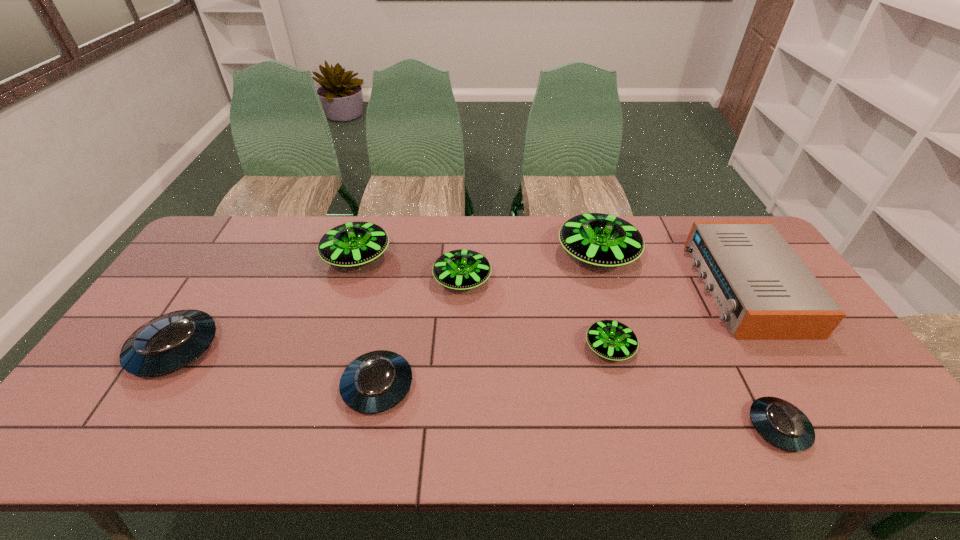
Identify the location of the tallest saucer. This screenshot has width=960, height=540. (598, 239).

The width and height of the screenshot is (960, 540). Identify the location of the tallest object. (598, 239).

This screenshot has height=540, width=960. I want to click on the leftmost green saucer, so click(352, 244).

The width and height of the screenshot is (960, 540). What are the coordinates of `the second biggest green saucer` in the screenshot? It's located at (352, 244).

Locate an element on the screen. radio receiver is located at coordinates (764, 291).

You are a GUI agent. You are given a task and a screenshot of the screen. Output one action in this format:
    pyautogui.click(x=<x>, y=<y>)
    Task: Click on the fourth saucer from right to left
    
    Given the screenshot: What is the action you would take?
    pyautogui.click(x=461, y=269)

At what (x,y) coordinates should I click in order to perform the action: click on the third biggest green saucer. Please return your answer as a coordinate pair (x, y). Image resolution: width=960 pixels, height=540 pixels. Looking at the image, I should click on (461, 269).

This screenshot has width=960, height=540. Identify the location of the leftmost saucer. (169, 342).

Find the location of a particular element. the biggest gray saucer is located at coordinates (169, 342).

Where is `the nearest green saucer`? the nearest green saucer is located at coordinates (613, 340).